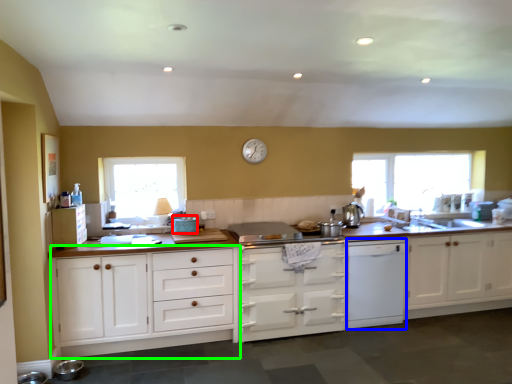
Question: Which is nearer to the appliance (highlighted by a red box)? dish washer (highlighted by a blue box) or cabinetry (highlighted by a green box).

Choices:
 (A) dish washer
 (B) cabinetry

Answer: (B)